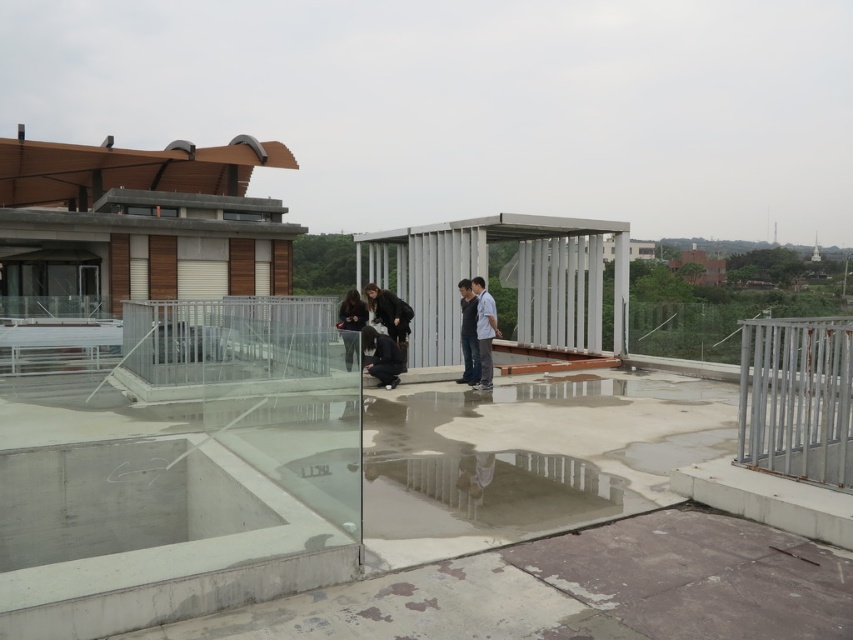
Looking at this image, can you confirm if matte black clothing at center is positioned to the right of dark gray fabric shirt at center?

Correct, you'll find matte black clothing at center to the right of dark gray fabric shirt at center.

Who is positioned more to the left, matte black clothing at center or dark gray fabric shirt at center?

dark gray fabric shirt at center

Between point (492, 324) and point (476, 380), which one is positioned behind?

Point (476, 380)

Where is `matte black clothing at center`? The height and width of the screenshot is (640, 853). matte black clothing at center is located at coordinates (479, 330).

Is dark brown leather jacket at center above matte black jacket at center?

Actually, dark brown leather jacket at center is below matte black jacket at center.

Is dark brown leather jacket at center to the left of matte black jacket at center from the viewer's perspective?

In fact, dark brown leather jacket at center is to the right of matte black jacket at center.

Which is behind, point (399, 362) or point (363, 308)?

The point (363, 308) is behind.

This screenshot has width=853, height=640. I want to click on dark brown leather jacket at center, so click(390, 316).

Is point (802, 401) less distant than point (386, 294)?

Yes.

Can you confirm if silver metallic rail at right is positioned to the left of dark brown leather jacket at center?

Incorrect, silver metallic rail at right is not on the left side of dark brown leather jacket at center.

Is point (820, 442) positioned behind point (405, 342)?

That is False.

Where is `silver metallic rail at right`? The image size is (853, 640). silver metallic rail at right is located at coordinates (796, 397).